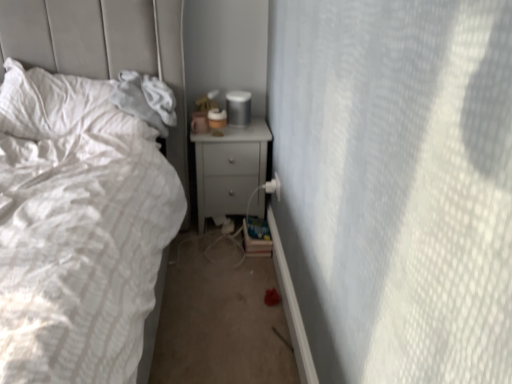
Question: In the image, is matte gray nightstand at center on the left side or the right side of white textured pillow at left?

Choices:
 (A) left
 (B) right

Answer: (B)

Question: In the image, is matte gray nightstand at center positioned in front of or behind white textured pillow at left?

Choices:
 (A) front
 (B) behind

Answer: (B)

Question: Considering the real-world distances, which object is closest to the matte plastic cup at upper right?

Choices:
 (A) white textured pillow at left
 (B) matte gray nightstand at center

Answer: (B)

Question: Which is nearer to the white textured pillow at left?

Choices:
 (A) matte gray nightstand at center
 (B) matte plastic cup at upper right

Answer: (A)